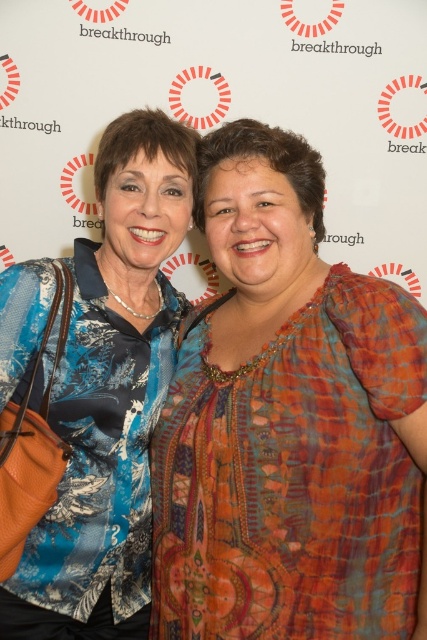
Question: Which point is closer to the camera taking this photo?

Choices:
 (A) (96, 346)
 (B) (231, 618)

Answer: (B)

Question: Does textured orange blouse at center have a lesser width compared to blue printed fabric at left?

Choices:
 (A) yes
 (B) no

Answer: (B)

Question: Is textured orange blouse at center positioned before blue printed fabric at left?

Choices:
 (A) yes
 (B) no

Answer: (A)

Question: Is textured orange blouse at center further to the viewer compared to blue printed fabric at left?

Choices:
 (A) no
 (B) yes

Answer: (A)